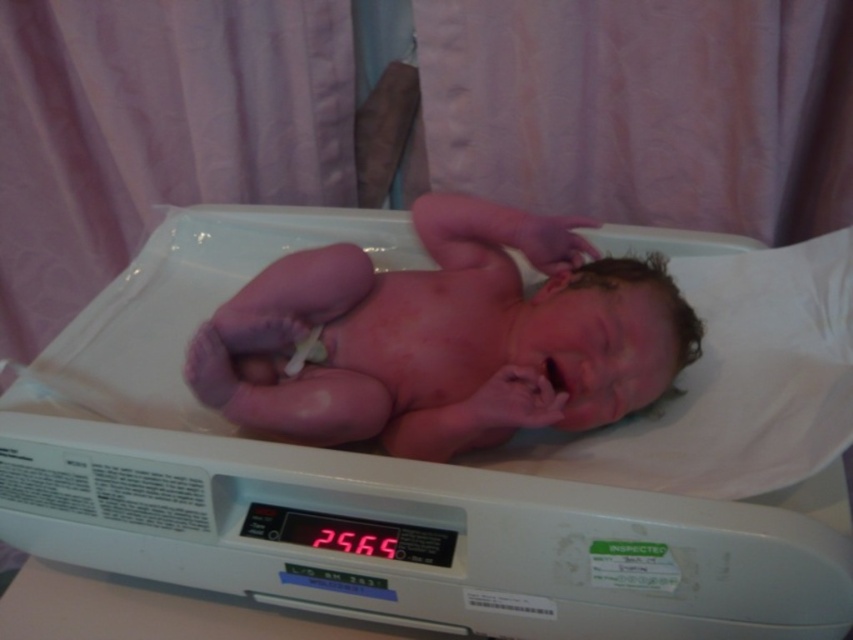
You are a nurse checking the baby in the image. You need to determine if the baby can be safely lifted from the white plastic scale at center without touching the pink smooth skin at center. Is this possible?

The white plastic scale at center is taller than pink smooth skin at center, so yes, the baby can be safely lifted from the white plastic scale at center without touching the pink smooth skin at center by lifting from the scale above the skin.

You are a nurse in a hospital nursery. You need to check the baby on the white plastic scale at center and the pink smooth skin at center. Which object is positioned to the left?

The white plastic scale at center is to the left of the pink smooth skin at center.

You are a nurse checking the baby in the image. The white plastic scale at center and the pink smooth skin at center are both in view. Which object is bigger in size?

The white plastic scale at center has a larger size compared to the pink smooth skin at center.